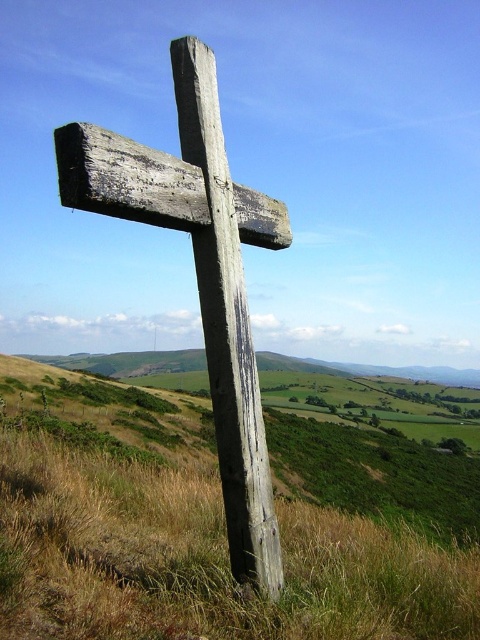
Can you confirm if dry grass at center is taller than weathered wood cross at center?

No, dry grass at center is not taller than weathered wood cross at center.

Does dry grass at center have a larger size compared to weathered wood cross at center?

Incorrect, dry grass at center is not larger than weathered wood cross at center.

Who is more forward, (384, 554) or (101, 204)?

Point (101, 204) is more forward.

Locate an element on the screen. dry grass at center is located at coordinates (203, 560).